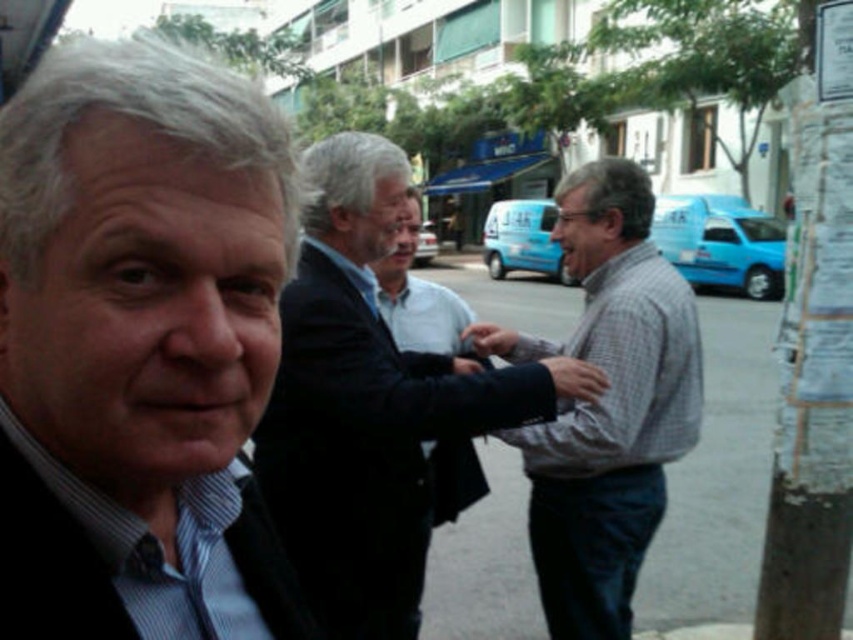
Question: Estimate the real-world distances between objects in this image. Which object is closer to the dark blue suit at center?

Choices:
 (A) white paper at right
 (B) white shirt at center
 (C) gray checkered shirt at center

Answer: (C)

Question: Can you confirm if dark blue suit at center is wider than white shirt at center?

Choices:
 (A) no
 (B) yes

Answer: (B)

Question: Which point is closer to the camera?

Choices:
 (A) matte black suit at left
 (B) gray checkered shirt at center
 (C) white shirt at center

Answer: (A)

Question: Which object appears closest to the camera in this image?

Choices:
 (A) gray checkered shirt at center
 (B) matte black suit at left
 (C) dark blue textured shirt at left
 (D) dark blue suit at center

Answer: (B)

Question: Can you confirm if matte black suit at left is wider than dark blue textured shirt at left?

Choices:
 (A) yes
 (B) no

Answer: (A)

Question: Is matte black suit at left to the right of white paper at right from the viewer's perspective?

Choices:
 (A) no
 (B) yes

Answer: (A)